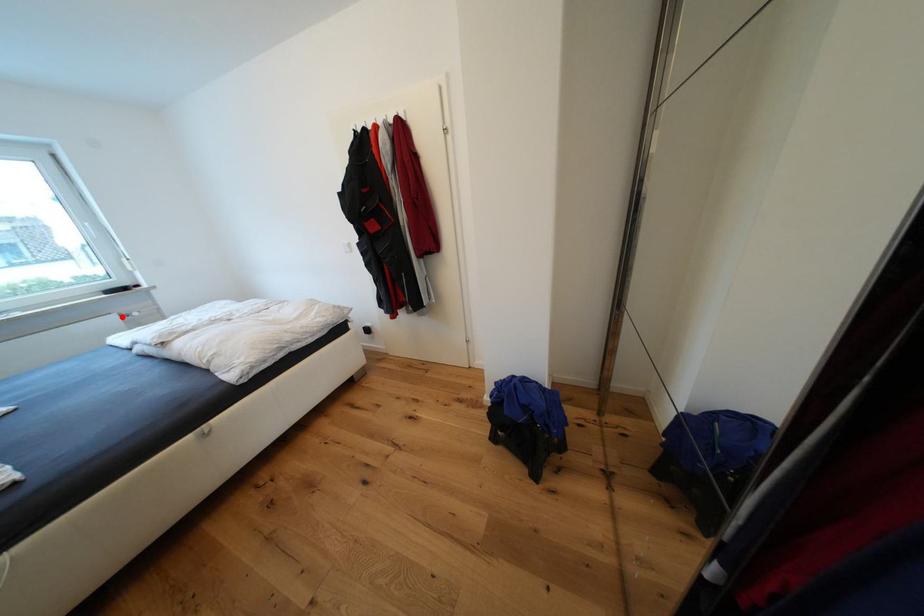
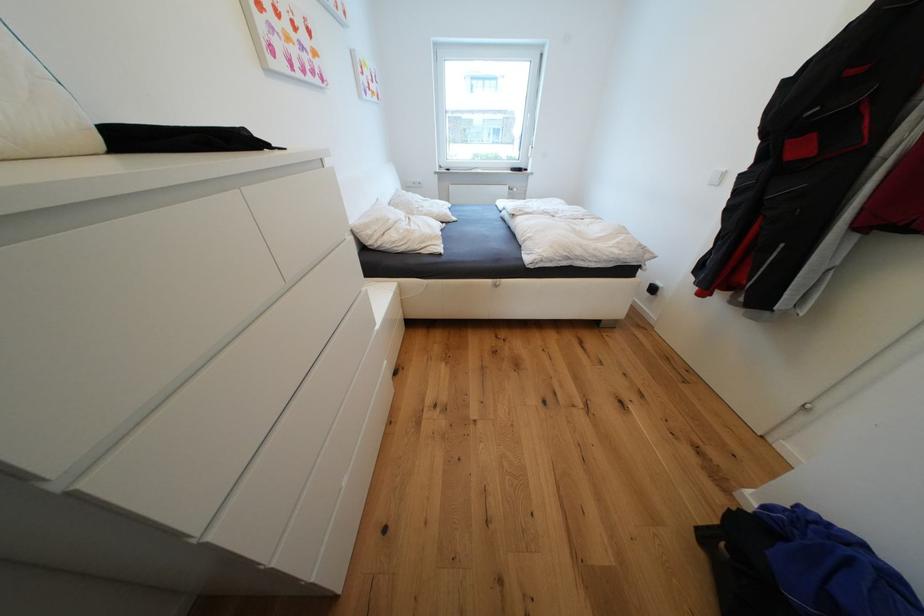
Locate, in the second image, the point that corresponds to the highlighted location in the first image.

(515, 188)